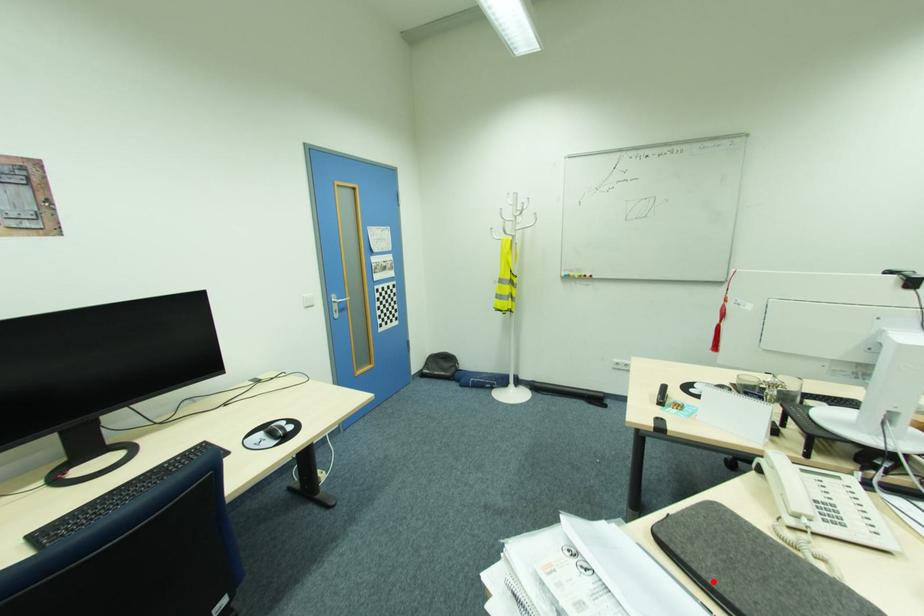
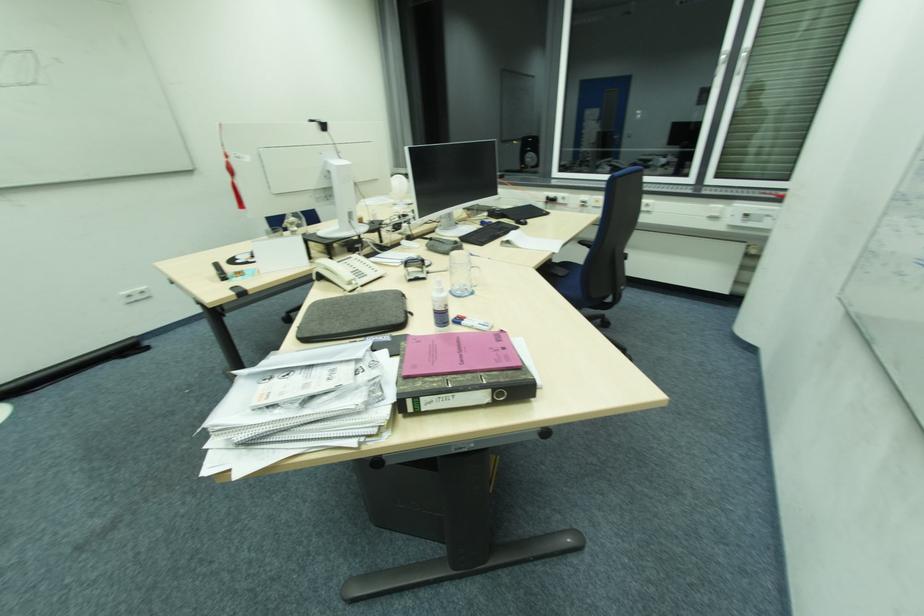
Locate, in the second image, the point that corresponds to the highlighted location in the first image.

(348, 331)